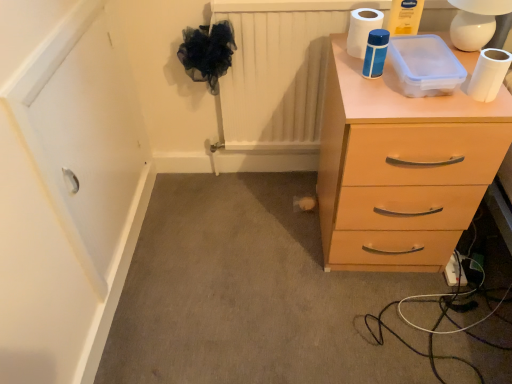
This screenshot has width=512, height=384. What do you see at coordinates (455, 271) in the screenshot?
I see `white plastic extension cord at lower right` at bounding box center [455, 271].

How much space does white matte toilet paper at upper right, the 2th toilet paper in the top-to-bottom sequence, occupy horizontally?

It is 2.73 inches.

In order to click on light wood chest of drawers at right in this screenshot , I will do `click(401, 168)`.

The image size is (512, 384). I want to click on white plastic extension cord at lower right, so click(455, 271).

From a real-world perspective, starting from the white plastic extension cord at lower right, which toilet paper is the 1st one vertically above it? Please provide its 2D coordinates.

[(489, 74)]

Based on the photo, is white matte toilet paper at upper right, which appears as the 1th toilet paper when ordered from the bottom, to the right of white plastic extension cord at lower right from the viewer's perspective?

In fact, white matte toilet paper at upper right, which appears as the 1th toilet paper when ordered from the bottom, is to the left of white plastic extension cord at lower right.

What's the angular difference between white matte toilet paper at upper right, the 1th toilet paper positioned from the front, and white plastic extension cord at lower right's facing directions?

There is a 0.0624-degree angle between the facing directions of white matte toilet paper at upper right, the 1th toilet paper positioned from the front, and white plastic extension cord at lower right.

What's the angular difference between light wood chest of drawers at right and white plastic extension cord at lower right's facing directions?

0.062 degrees.

Which object is positioned more to the left, light wood chest of drawers at right or white plastic extension cord at lower right?

Positioned to the left is light wood chest of drawers at right.

Looking at this image, are light wood chest of drawers at right and white plastic extension cord at lower right far apart?

No, light wood chest of drawers at right is in close proximity to white plastic extension cord at lower right.

Considering the sizes of objects light wood chest of drawers at right and white plastic extension cord at lower right in the image provided, who is smaller, light wood chest of drawers at right or white plastic extension cord at lower right?

With smaller size is white plastic extension cord at lower right.

Considering the relative positions of light wood chest of drawers at right and white matte toilet paper at upper right, which is the second toilet paper from back to front, in the image provided, is light wood chest of drawers at right to the left or to the right of white matte toilet paper at upper right, which is the second toilet paper from back to front,?

In the image, light wood chest of drawers at right appears on the left side of white matte toilet paper at upper right, which is the second toilet paper from back to front.

From a real-world perspective, which object rests below the other?

light wood chest of drawers at right is physically lower.

From the image's perspective, is light wood chest of drawers at right located above white matte toilet paper at upper right, the 2th toilet paper in the top-to-bottom sequence?

No.

Between light wood chest of drawers at right and white matte toilet paper at upper right, which appears as the 1th toilet paper when ordered from the bottom, which one has more height?

light wood chest of drawers at right is taller.

Identify the location of toilet paper in front of the white matte toilet paper at upper right, arranged as the second toilet paper when viewed from the front. (489, 74).

From the image's perspective, which one is positioned lower, white matte toilet paper at upper right, positioned as the 2th toilet paper in left-to-right order, or white matte toilet paper at upper right, the first toilet paper from the back?

white matte toilet paper at upper right, positioned as the 2th toilet paper in left-to-right order, is shown below in the image.

Between point (497, 71) and point (352, 56), which one is positioned behind?

The point (352, 56) is more distant.

How different are the orientations of white matte toilet paper at upper right, which is the 2th toilet paper in right-to-left order, and light wood chest of drawers at right in degrees?

The angle between the facing direction of white matte toilet paper at upper right, which is the 2th toilet paper in right-to-left order, and the facing direction of light wood chest of drawers at right is 0.00038 degrees.

Are white matte toilet paper at upper right, the 1th toilet paper in the top-to-bottom sequence, and light wood chest of drawers at right located far from each other?

They are positioned close to each other.

From a real-world perspective, is white matte toilet paper at upper right, arranged as the second toilet paper when viewed from the front, positioned above or below light wood chest of drawers at right?

white matte toilet paper at upper right, arranged as the second toilet paper when viewed from the front, is situated higher than light wood chest of drawers at right in the real world.

Where is `chest of drawers below the white matte toilet paper at upper right, arranged as the second toilet paper when viewed from the front (from a real-world perspective)`? The width and height of the screenshot is (512, 384). chest of drawers below the white matte toilet paper at upper right, arranged as the second toilet paper when viewed from the front (from a real-world perspective) is located at coordinates (401, 168).

From the image's perspective, would you say white matte toilet paper at upper right, the first toilet paper from the back, is shown under white plastic extension cord at lower right?

Incorrect, from the image's perspective, white matte toilet paper at upper right, the first toilet paper from the back, is higher than white plastic extension cord at lower right.

Does white matte toilet paper at upper right, arranged as the second toilet paper when viewed from the front, have a lesser height compared to white plastic extension cord at lower right?

No.

Looking at this image, is white matte toilet paper at upper right, the second toilet paper ordered from the bottom, touching white plastic extension cord at lower right?

There is a gap between white matte toilet paper at upper right, the second toilet paper ordered from the bottom, and white plastic extension cord at lower right.

Locate an element on the screen. the 2nd toilet paper above the white plastic extension cord at lower right (from a real-world perspective) is located at coordinates (362, 29).

From the image's perspective, relative to light wood chest of drawers at right, is white matte toilet paper at upper right, which is the second toilet paper from back to front, above or below?

white matte toilet paper at upper right, which is the second toilet paper from back to front, is above light wood chest of drawers at right.

Visually, is white matte toilet paper at upper right, which is the second toilet paper from back to front, positioned to the left or to the right of light wood chest of drawers at right?

From the image, it's evident that white matte toilet paper at upper right, which is the second toilet paper from back to front, is to the right of light wood chest of drawers at right.

Does point (508, 60) lie in front of point (397, 203)?

Yes, point (508, 60) is closer to viewer.

Considering the sizes of objects white matte toilet paper at upper right, the 1th toilet paper positioned from the front, and light wood chest of drawers at right in the image provided, who is bigger, white matte toilet paper at upper right, the 1th toilet paper positioned from the front, or light wood chest of drawers at right?

With larger size is light wood chest of drawers at right.

Image resolution: width=512 pixels, height=384 pixels. I want to click on extension cord below the white matte toilet paper at upper right, the 1th toilet paper positioned from the front (from the image's perspective), so point(455,271).

You are a GUI agent. You are given a task and a screenshot of the screen. Output one action in this format:
    pyautogui.click(x=<x>, y=<y>)
    Task: Click on the chest of drawers that is in front of the white plastic extension cord at lower right
    Image resolution: width=512 pixels, height=384 pixels.
    Given the screenshot: What is the action you would take?
    pyautogui.click(x=401, y=168)

Based on the photo, considering their positions, is white matte toilet paper at upper right, which is the second toilet paper from back to front, positioned further to light wood chest of drawers at right than white plastic extension cord at lower right?

white plastic extension cord at lower right lies further to light wood chest of drawers at right than the other object.

Looking at this image, considering their positions, is light wood chest of drawers at right positioned further to white plastic extension cord at lower right than white matte toilet paper at upper right, which is the second toilet paper from back to front?

white matte toilet paper at upper right, which is the second toilet paper from back to front.

From the picture: From the image, which object appears to be nearer to white matte toilet paper at upper right, the 2th toilet paper in the top-to-bottom sequence, white plastic extension cord at lower right or light wood chest of drawers at right?

light wood chest of drawers at right is closer to white matte toilet paper at upper right, the 2th toilet paper in the top-to-bottom sequence.

Estimate the real-world distances between objects in this image. Which object is closer to white matte toilet paper at upper right, the 1th toilet paper positioned from the front, white matte toilet paper at upper right, the 1th toilet paper in the top-to-bottom sequence, or white plastic extension cord at lower right?

white matte toilet paper at upper right, the 1th toilet paper in the top-to-bottom sequence.

Which object lies further to the anchor point light wood chest of drawers at right, white plastic extension cord at lower right or white matte toilet paper at upper right, which is the 2th toilet paper in right-to-left order?

Based on the image, white plastic extension cord at lower right appears to be further to light wood chest of drawers at right.

From the image, which object appears to be farther from light wood chest of drawers at right, white matte toilet paper at upper right, which is the 2th toilet paper in right-to-left order, or white matte toilet paper at upper right, the 2th toilet paper in the top-to-bottom sequence?

white matte toilet paper at upper right, which is the 2th toilet paper in right-to-left order.

Based on their spatial positions, is light wood chest of drawers at right or white matte toilet paper at upper right, which appears as the 1th toilet paper when ordered from the bottom, closer to white matte toilet paper at upper right, the 1th toilet paper in the top-to-bottom sequence?

white matte toilet paper at upper right, which appears as the 1th toilet paper when ordered from the bottom.

When comparing their distances from white plastic extension cord at lower right, does white matte toilet paper at upper right, arranged as the second toilet paper when viewed from the front, or light wood chest of drawers at right seem closer?

light wood chest of drawers at right is closer to white plastic extension cord at lower right.

I want to click on toilet paper that lies between white matte toilet paper at upper right, which is the 2th toilet paper in right-to-left order, and white plastic extension cord at lower right from top to bottom, so click(x=489, y=74).

Where is `toilet paper between white matte toilet paper at upper right, the second toilet paper ordered from the bottom, and light wood chest of drawers at right from top to bottom`? toilet paper between white matte toilet paper at upper right, the second toilet paper ordered from the bottom, and light wood chest of drawers at right from top to bottom is located at coordinates (489, 74).

I want to click on chest of drawers between white matte toilet paper at upper right, which is the second toilet paper from back to front, and white plastic extension cord at lower right in the up-down direction, so (x=401, y=168).

Identify the location of chest of drawers between white matte toilet paper at upper right, the 1th toilet paper when ordered from left to right, and white plastic extension cord at lower right in the up-down direction. (401, 168).